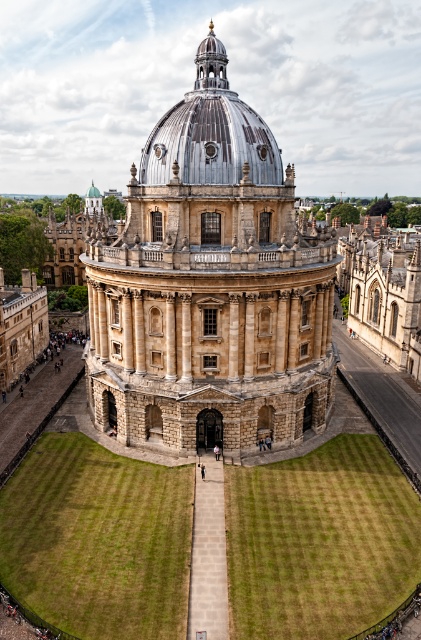
Question: Is the position of golden stone dome at center more distant than that of shiny silver dome at center?

Choices:
 (A) no
 (B) yes

Answer: (A)

Question: From the image, what is the correct spatial relationship of golden stone dome at center in relation to shiny silver dome at center?

Choices:
 (A) right
 (B) left

Answer: (A)

Question: Which object is farther from the camera taking this photo?

Choices:
 (A) shiny silver dome at center
 (B) golden stone dome at center

Answer: (A)

Question: Which of the following is the closest to the observer?

Choices:
 (A) (157, 237)
 (B) (272, 147)

Answer: (B)

Question: Does golden stone dome at center appear on the right side of shiny silver dome at center?

Choices:
 (A) yes
 (B) no

Answer: (A)